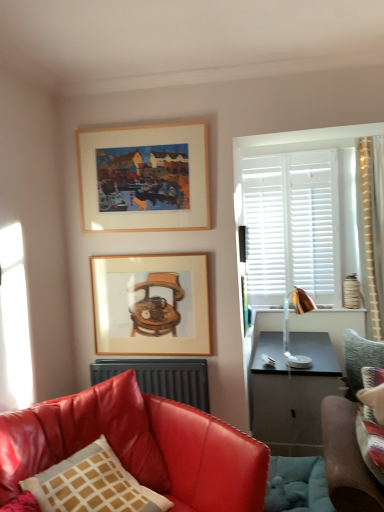
What are the coordinates of `free space above wooden framed picture at center, the 2th picture frame viewed from the top (from a real-world perspective)` in the screenshot? It's located at (156, 251).